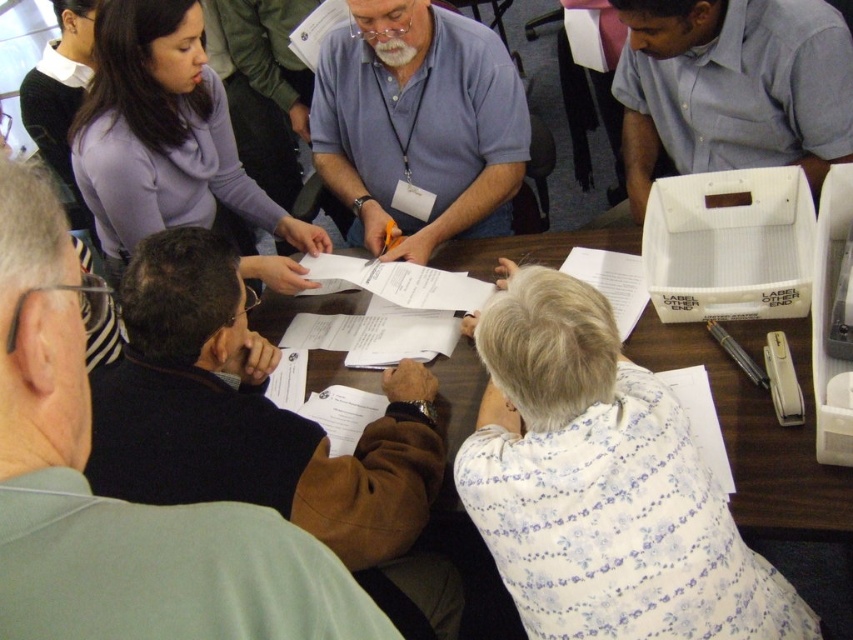
Who is more distant from viewer, [520,506] or [175,173]?

Positioned behind is point [175,173].

Does white floral blouse at lower center appear under purple matte sweater at upper left?

Yes.

Who is more forward, (555, 452) or (120, 74)?

Point (555, 452) is more forward.

In order to click on white floral blouse at lower center in this screenshot , I will do `click(602, 484)`.

Is dark brown leather jacket at lower left further to camera compared to purple matte sweater at upper left?

That is False.

Between point (20, 168) and point (141, 83), which one is positioned in front?

Point (20, 168) is in front.

Is point (239, 524) less distant than point (102, 131)?

Yes, point (239, 524) is in front of point (102, 131).

Where is `dark brown leather jacket at lower left`? The height and width of the screenshot is (640, 853). dark brown leather jacket at lower left is located at coordinates (120, 500).

Can you confirm if blue shirt at center is bigger than purple matte sweater at upper left?

No.

Is point (335, 129) positioned after point (163, 106)?

Yes, point (335, 129) is farther from viewer.

At what (x,y) coordinates should I click in order to perform the action: click on blue shirt at center. Please return your answer as a coordinate pair (x, y). Image resolution: width=853 pixels, height=640 pixels. Looking at the image, I should click on (418, 124).